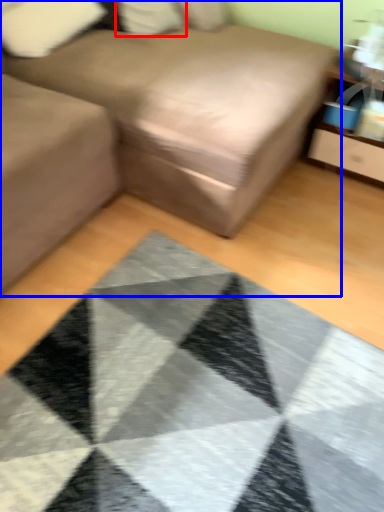
Question: Which object is further to the camera taking this photo, pillow (highlighted by a red box) or studio couch (highlighted by a blue box)?

Choices:
 (A) pillow
 (B) studio couch

Answer: (A)